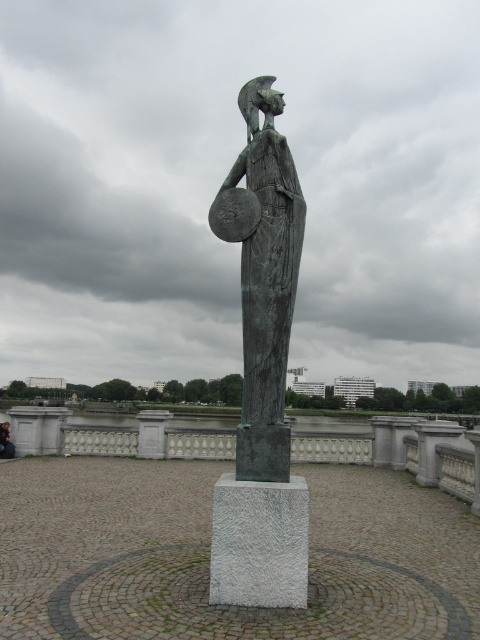
You are standing in the paved area in front of the statue. You want to take a photo of the dark brown leather jacket at center without the green patina statue at center blocking the view. Is this possible from your current position?

The green patina statue at center is in front of the dark brown leather jacket at center, so it is blocking the view. To take a photo of the dark brown leather jacket at center without the statue blocking the view, you would need to move to a position where the statue is not between you and the jacket.

You are an urban planner assessing the space around the green patina statue at center and the dark brown leather jacket at center. Considering their sizes, which object would require more space for a safety perimeter around it?

The green patina statue at center has a larger size compared to the dark brown leather jacket at center, so it would require a larger safety perimeter.